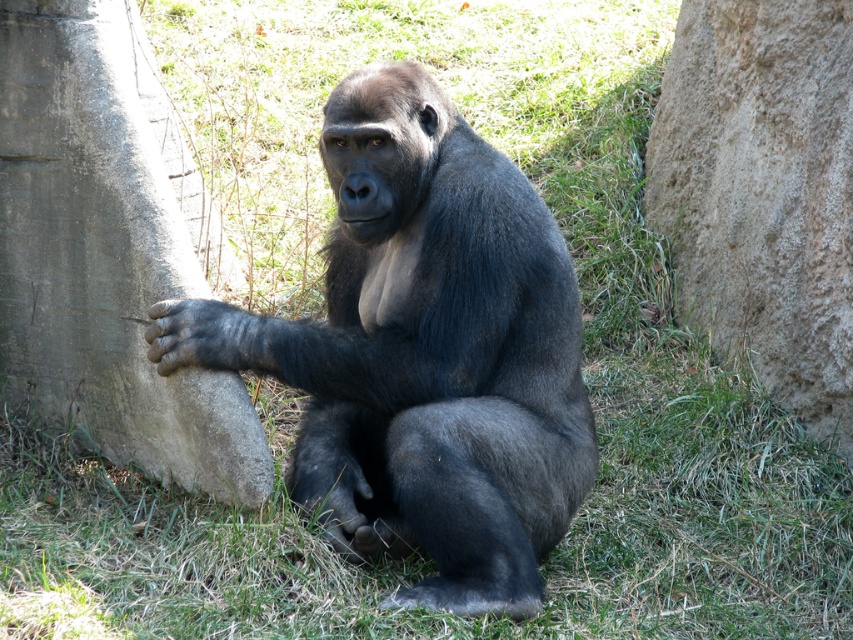
You are a zookeeper who needs to place a new feeding station in the enclosure. The station must be placed at the point marked by the coordinates point [438,356]. Where should you place the feeding station in relation to the shiny black gorilla at center?

The point [438,356] marks the location of the shiny black gorilla at center, so the feeding station should be placed directly at the shiny black gorilla at center.

You are a zookeeper who needs to ensure that the shiny black gorilla at center can move freely between the gray concrete tree trunk at left and the enclosure wall on the right. Based on their sizes, is there enough space for the gorilla to move sideways without touching either structure?

The shiny black gorilla at center might be wider than the gray concrete tree trunk at left, so there might not be enough space for the gorilla to move sideways without touching either structure.

You are a zookeeper trying to place a new feeding station in the enclosure. The gray concrete tree trunk at left is located at point (108, 250). Where should you place the feeding station so it is not directly under the trunk?

Place the feeding station away from the point (108, 250) where the gray concrete tree trunk at left is located to ensure it is not directly under the trunk.